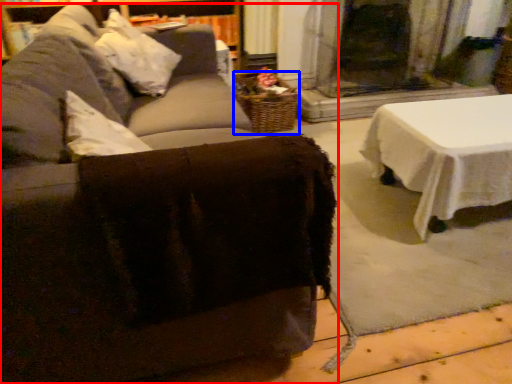
Question: Which object appears closest to the camera in this image, studio couch (highlighted by a red box) or basket (highlighted by a blue box)?

Choices:
 (A) studio couch
 (B) basket

Answer: (A)